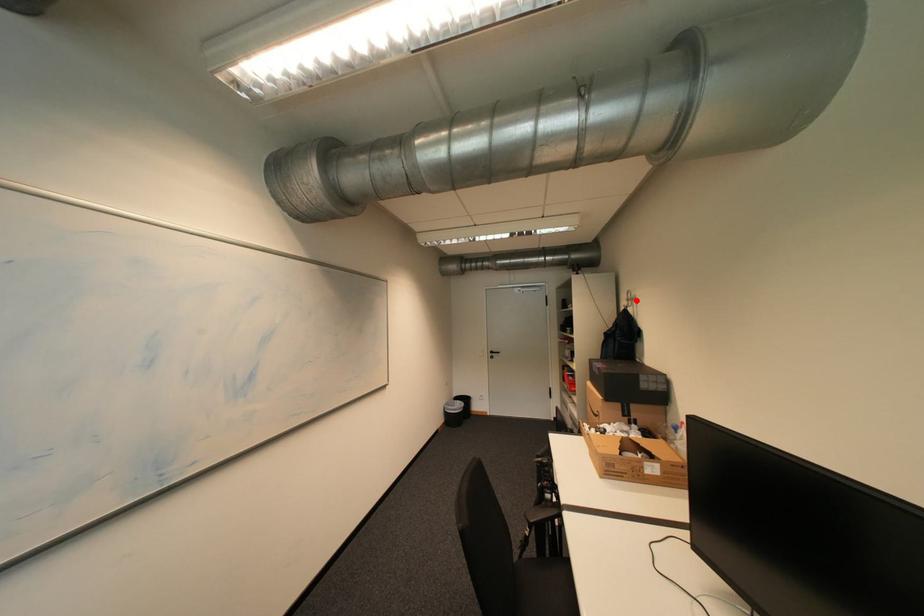
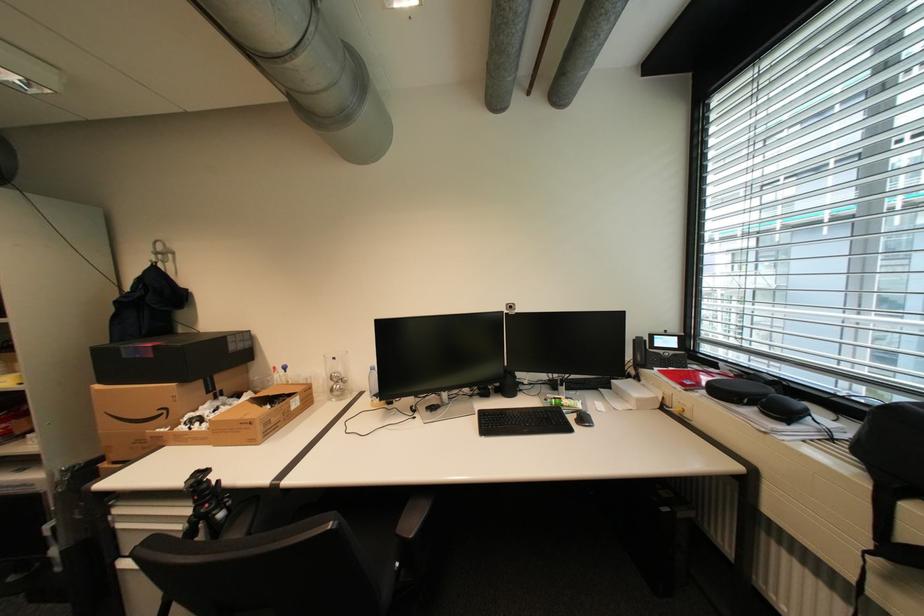
Locate, in the second image, the point that corresponds to the highlighted location in the first image.

(165, 254)